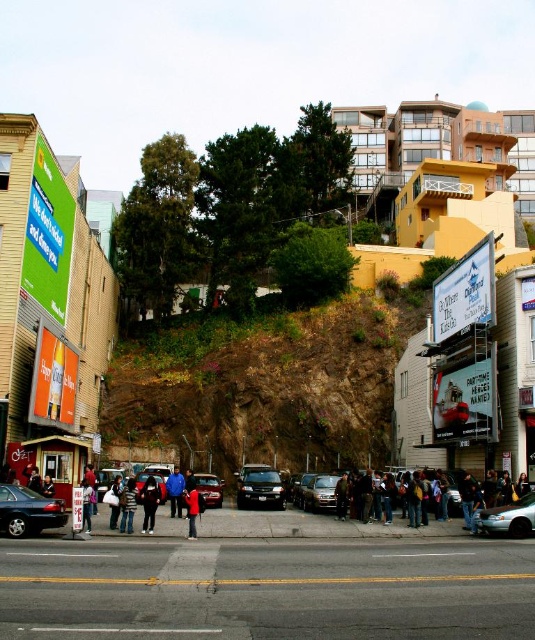
Question: Does blue fabric jacket at center appear on the left side of red matte jacket at center?

Choices:
 (A) no
 (B) yes

Answer: (B)

Question: Is shiny black sedan at lower left wider than satin black sedan at center?

Choices:
 (A) yes
 (B) no

Answer: (A)

Question: Which is farther from the dark blue jeans at lower left?

Choices:
 (A) satin black suv at center
 (B) light blue metallic sedan at lower right
 (C) dark brown leather jacket at center
 (D) dark blue jeans at lower center

Answer: (B)

Question: Which point appears closest to the camera in this image?

Choices:
 (A) 133,508
 (B) 87,513
 (C) 208,499

Answer: (B)

Question: Among these objects, which one is farthest from the camera?

Choices:
 (A) satin black sedan at center
 (B) shiny black sedan at lower left
 (C) dark gray hoodie at center
 (D) satin black suv at center

Answer: (D)

Question: Is satin black suv at center in front of blue fabric jacket at center?

Choices:
 (A) no
 (B) yes

Answer: (A)